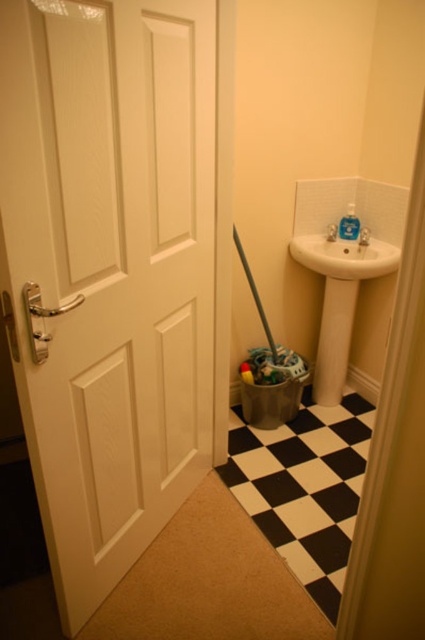
You are moving a metallic silver brush at center into the room through the white matte door at left. Can you fit the brush through the door without tilting it?

The white matte door at left is to the left of metallic silver brush at center, so the brush can be moved through the door without tilting since the door is positioned to the side of the brush.

You are organizing tools in a utility room. You have a metallic silver brush at center and a white glossy sink at upper right. Where should you place the brush to be closer to the sink?

You should place the metallic silver brush at center to the left of the white glossy sink at upper right since the sink is already to the right of the brush.

You are standing in the utility area and need to exit through the white matte door at left. To do so, you must first move the metallic silver brush at center out of the way. Is the door accessible from its current position?

The white matte door at left is located below the metallic silver brush at center, which means the brush is blocking the door. Therefore, you must move the metallic silver brush at center to access the white matte door at left.